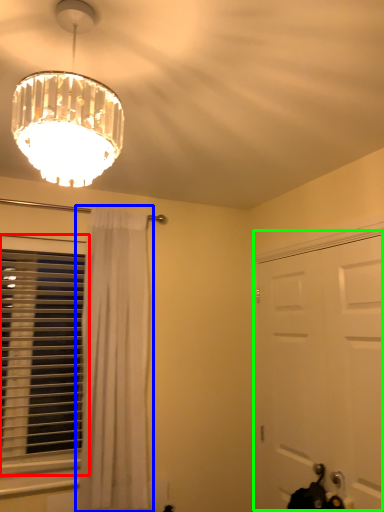
Question: Which is farther away from window (highlighted by a red box)? curtain (highlighted by a blue box) or door (highlighted by a green box)?

Choices:
 (A) curtain
 (B) door

Answer: (B)